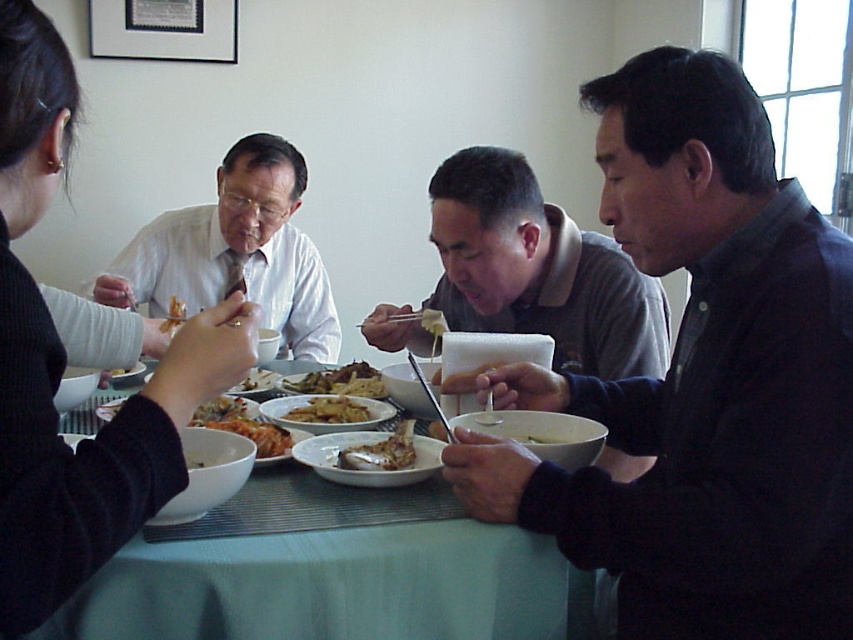
You are sitting at the dining table and want to reach for an item located at either point. Which point, point (329, 392) or point (428, 317), is closer to you?

Point (329, 392) is closer to the viewer than point (428, 317), so you should reach for the item at point (329, 392).

You are standing at the origin point of the coordinate system in the image. You want to reach the dark gray sweater at right. What are the coordinates you need to move to?

The coordinates to reach the dark gray sweater at right are at point [701,380].